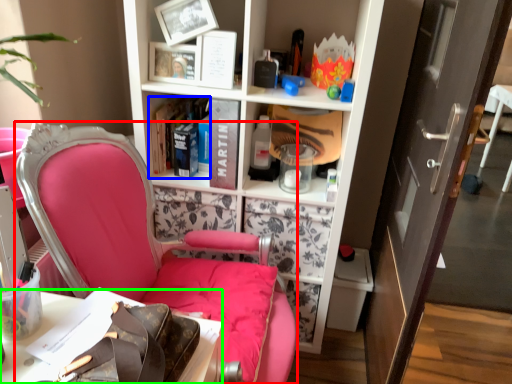
Question: Which object is positioned farthest from chair (highlighted by a red box)? Select from book (highlighted by a blue box) and desk (highlighted by a green box).

Choices:
 (A) book
 (B) desk

Answer: (A)